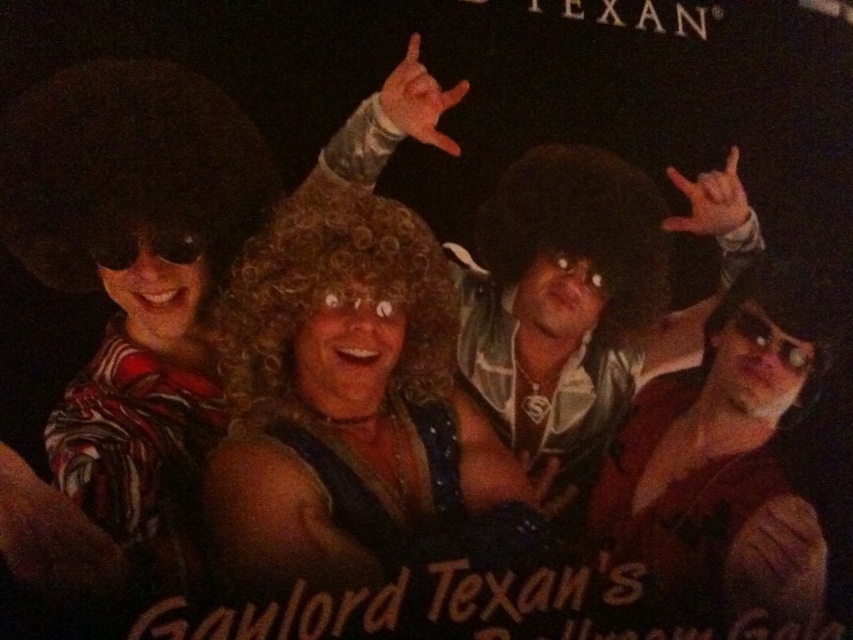
Which is behind, point (556, 164) or point (775, 609)?

The point (775, 609) is more distant.

Where is `curly blonde wig at center`? The width and height of the screenshot is (853, 640). curly blonde wig at center is located at coordinates pyautogui.click(x=582, y=300).